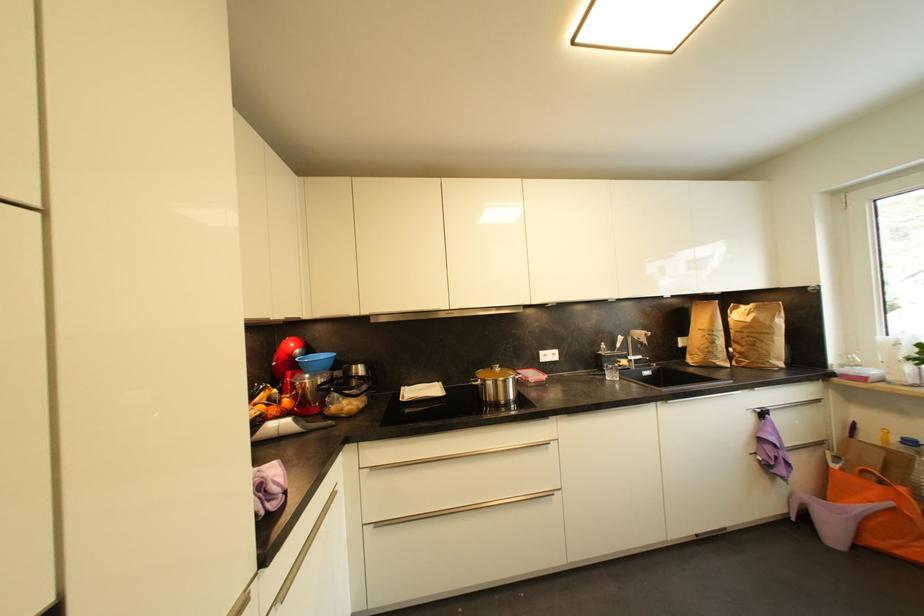
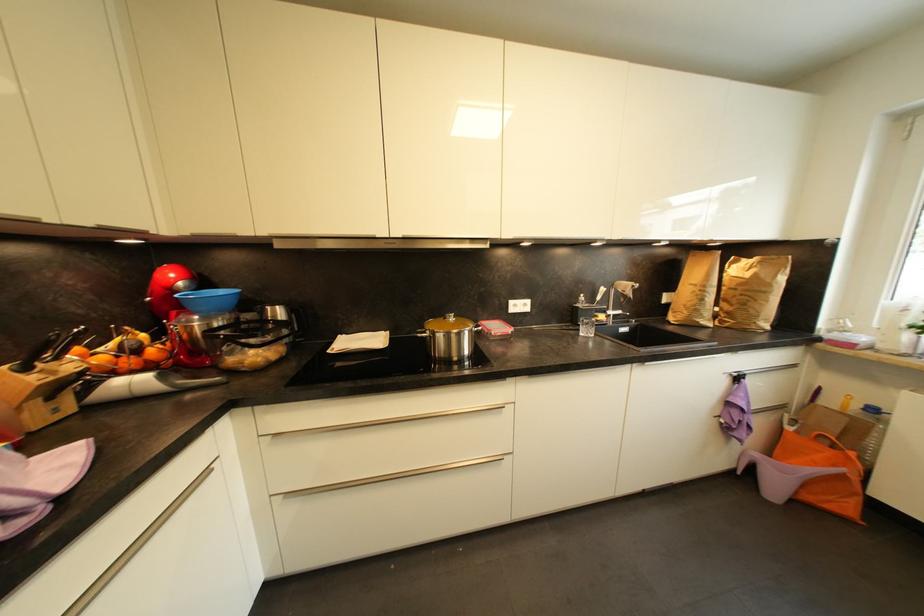
Question: How did the camera likely rotate?

Choices:
 (A) Left
 (B) Right
 (C) Up
 (D) Down

Answer: (D)